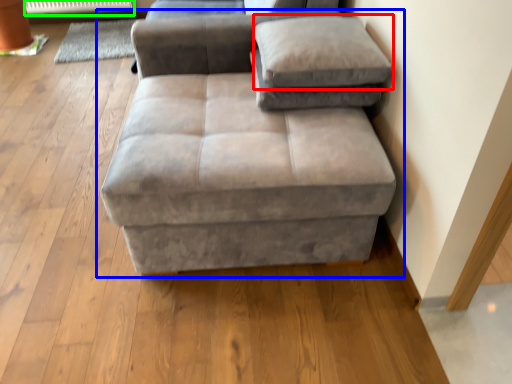
Question: Estimate the real-world distances between objects in this image. Which object is farther from pillow (highlighted by a red box), studio couch (highlighted by a blue box) or radiator (highlighted by a green box)?

Choices:
 (A) studio couch
 (B) radiator

Answer: (B)